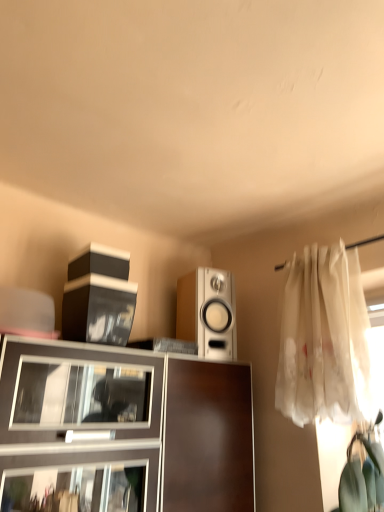
Question: Is white glossy speaker at center smaller than white sheer curtain at right?

Choices:
 (A) no
 (B) yes

Answer: (B)

Question: Does white glossy speaker at center appear on the left side of white sheer curtain at right?

Choices:
 (A) no
 (B) yes

Answer: (B)

Question: Can you see white glossy speaker at center touching white sheer curtain at right?

Choices:
 (A) yes
 (B) no

Answer: (B)

Question: Does white glossy speaker at center lie in front of white sheer curtain at right?

Choices:
 (A) no
 (B) yes

Answer: (A)

Question: Is white glossy speaker at center shorter than white sheer curtain at right?

Choices:
 (A) yes
 (B) no

Answer: (A)

Question: Which is correct: white glossy speaker at center is inside white sheer curtain at right, or outside of it?

Choices:
 (A) inside
 (B) outside

Answer: (B)

Question: Looking at the image, does white glossy speaker at center seem bigger or smaller compared to white sheer curtain at right?

Choices:
 (A) big
 (B) small

Answer: (B)

Question: From a real-world perspective, is white glossy speaker at center physically located above or below white sheer curtain at right?

Choices:
 (A) above
 (B) below

Answer: (A)

Question: Looking at their shapes, would you say white glossy speaker at center is wider or thinner than white sheer curtain at right?

Choices:
 (A) wide
 (B) thin

Answer: (A)

Question: In the image, is white glossy speaker at center on the left side or the right side of matte brown cabinet at center?

Choices:
 (A) left
 (B) right

Answer: (B)

Question: From the image's perspective, is white glossy speaker at center located above or below matte brown cabinet at center?

Choices:
 (A) above
 (B) below

Answer: (A)

Question: Would you say white glossy speaker at center is inside or outside matte brown cabinet at center?

Choices:
 (A) outside
 (B) inside

Answer: (A)

Question: From their relative heights in the image, would you say white glossy speaker at center is taller or shorter than matte brown cabinet at center?

Choices:
 (A) tall
 (B) short

Answer: (B)

Question: Relative to white sheer curtain at right, is matte brown cabinet at center in front or behind?

Choices:
 (A) behind
 (B) front

Answer: (B)

Question: Is matte brown cabinet at center situated inside white sheer curtain at right or outside?

Choices:
 (A) inside
 (B) outside

Answer: (B)